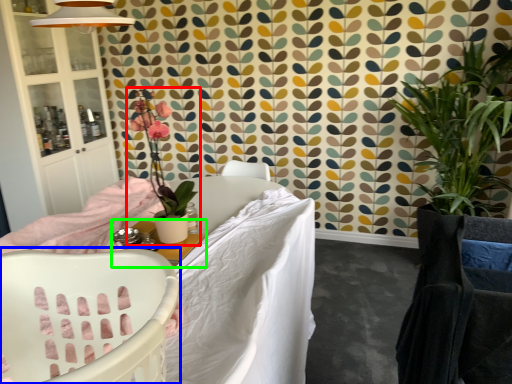
Question: Which object is the farthest from houseplant (highlighted by a red box)? Choose among these: chair (highlighted by a blue box) or table (highlighted by a green box).

Choices:
 (A) chair
 (B) table

Answer: (A)